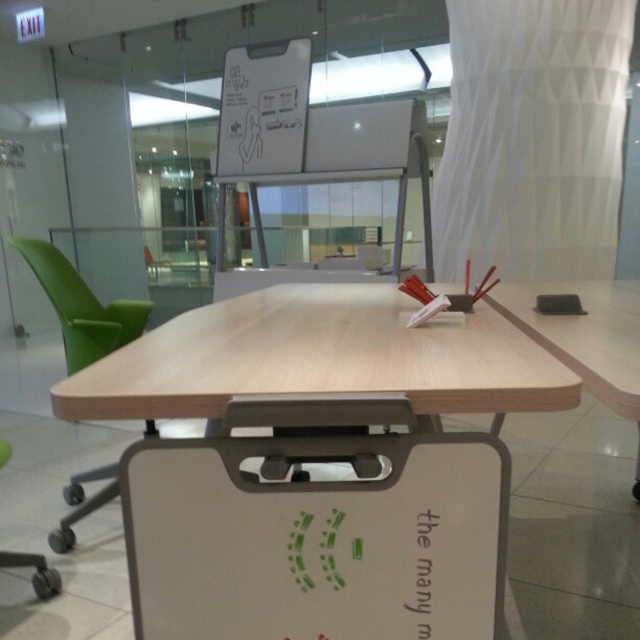
Who is more distant from viewer, (x=38, y=268) or (x=150, y=266)?

Positioned behind is point (x=150, y=266).

Is the position of green plastic chair at left less distant than that of green fabric chair at left?

Yes, green plastic chair at left is closer to the viewer.

The image size is (640, 640). I want to click on green plastic chair at left, so click(x=81, y=307).

Locate an element on the screen. This screenshot has height=640, width=640. green plastic chair at left is located at coordinates (81, 307).

Is white matte dry erase board at upper center above green plastic chair at left?

Yes, white matte dry erase board at upper center is above green plastic chair at left.

Is white matte dry erase board at upper center wider than green plastic chair at left?

Correct, the width of white matte dry erase board at upper center exceeds that of green plastic chair at left.

Between point (246, 144) and point (118, 344), which one is positioned in front?

Point (118, 344)

What are the coordinates of `white matte dry erase board at upper center` in the screenshot? It's located at (262, 109).

Can you confirm if light wood table at center is smaller than green plastic chair at left?

Incorrect, light wood table at center is not smaller in size than green plastic chair at left.

Which of these two, light wood table at center or green plastic chair at left, stands taller?

Standing taller between the two is green plastic chair at left.

Is point (220, 352) closer to camera compared to point (67, 304)?

That is True.

You are a GUI agent. You are given a task and a screenshot of the screen. Output one action in this format:
    pyautogui.click(x=<x>, y=<y>)
    Task: Click on the light wood table at center
    The width and height of the screenshot is (640, 640).
    Given the screenshot: What is the action you would take?
    pyautogui.click(x=317, y=358)